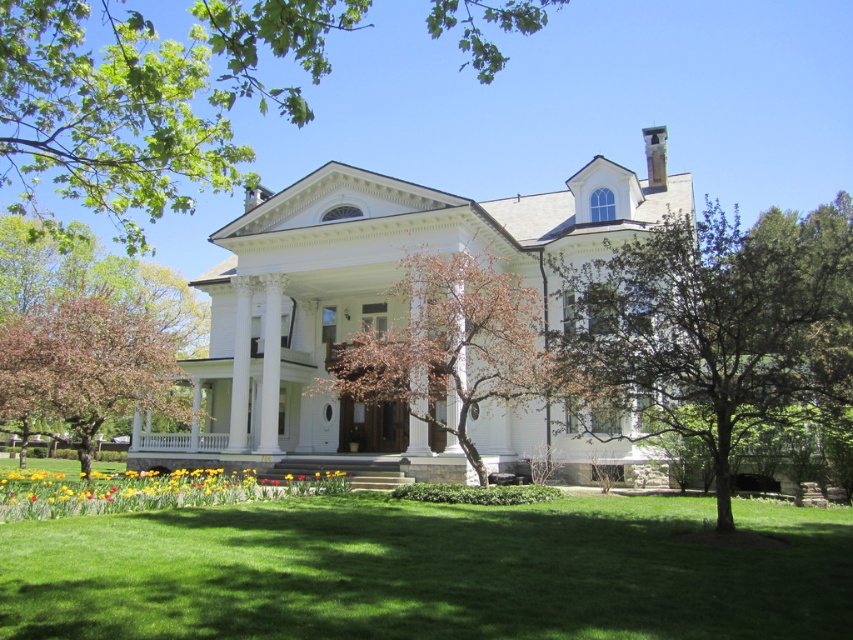
You are standing in the front yard of the house and want to plant a new bush. The green leafy tree at upper center and the yellow matte flowers at lower center are already present. Which object is located higher up in the image?

The green leafy tree at upper center is positioned over the yellow matte flowers at lower center, so it is located higher up in the image.

You are standing on the lawn in front of the house and want to walk from the brown textured tree at center to the yellow matte flowers at lower center. Which direction should you head to reach them?

The brown textured tree at center is positioned on the right side of yellow matte flowers at lower center, so you should head to the left to reach them.